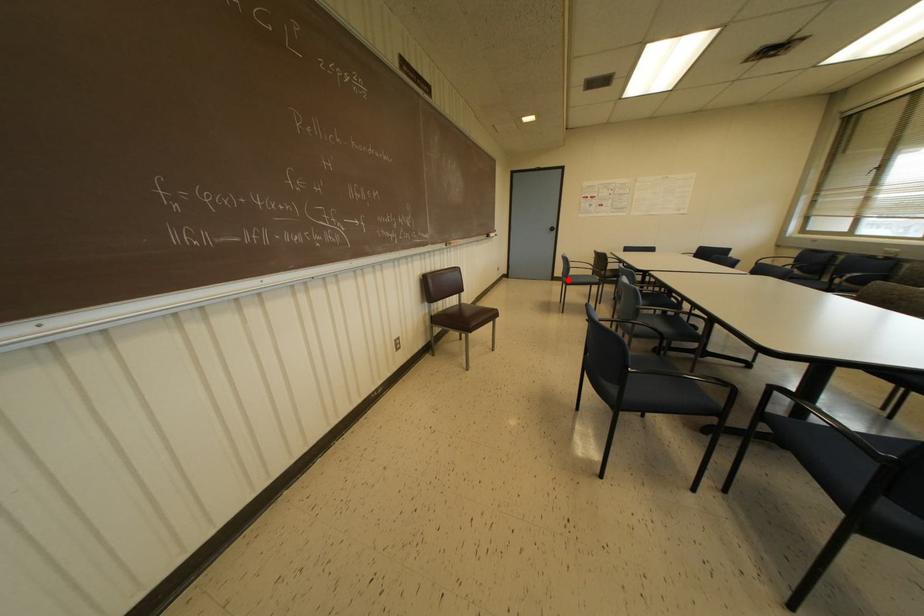
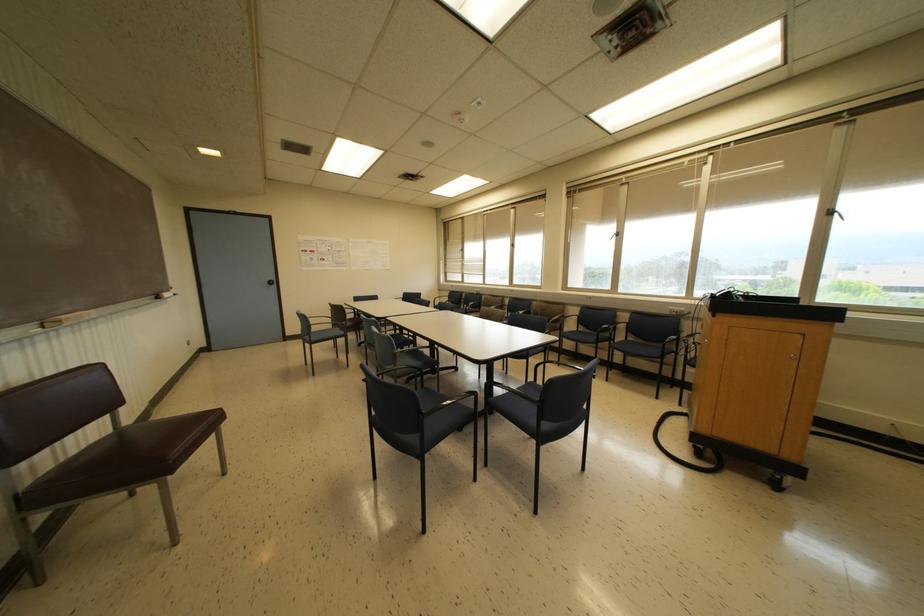
Question: I am providing you with two images of the same scene from different viewpoints. Given a red point in image1, look at the same physical point in image2. Is it:

Choices:
 (A) Closer to the viewpoint
 (B) Farther from the viewpoint

Answer: (B)